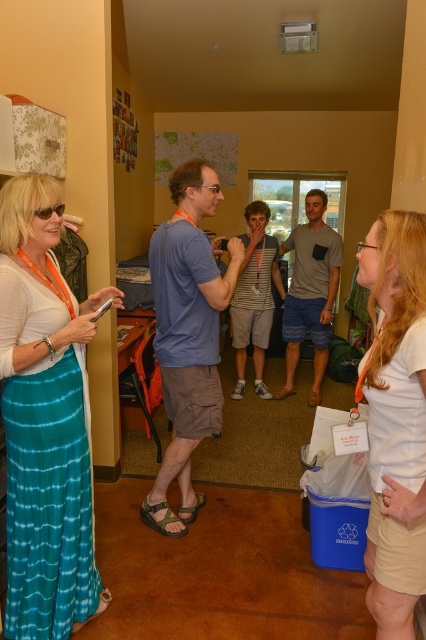
In the scene shown: You are taking a photo of the scene and want to focus on both the point at (377, 625) and the point at (227, 301). Which point should you adjust your focus to first to ensure both are in focus?

You should focus on the point at (227, 301) first because it is farther from the camera than the point at (377, 625). By focusing on the farther point, the closer point will also be within the depth of field, ensuring both are in focus.

You are standing in the room and want to hand a document to someone. The document is on the floor near the white cotton shirt at right. Can you reach it without moving from your current position?

The white cotton shirt at right is 4.02 feet away from the camera, so if you are standing at the camera position, you can likely reach the document on the floor near the white cotton shirt at right without needing to move.